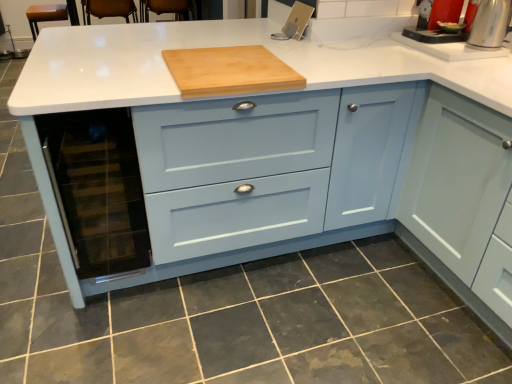
Question: Is the position of natural wood cutting board at center more distant than that of satin silver kettle at upper right?

Choices:
 (A) yes
 (B) no

Answer: (B)

Question: Is natural wood cutting board at center placed right next to satin silver kettle at upper right?

Choices:
 (A) no
 (B) yes

Answer: (A)

Question: From the image's perspective, does natural wood cutting board at center appear higher than satin silver kettle at upper right?

Choices:
 (A) no
 (B) yes

Answer: (A)

Question: Can you confirm if natural wood cutting board at center is positioned to the right of satin silver kettle at upper right?

Choices:
 (A) yes
 (B) no

Answer: (B)

Question: Is natural wood cutting board at center closer to camera compared to satin silver kettle at upper right?

Choices:
 (A) yes
 (B) no

Answer: (A)

Question: Is satin silver kettle at upper right bigger or smaller than white glossy sink at upper right?

Choices:
 (A) big
 (B) small

Answer: (B)

Question: Do you think satin silver kettle at upper right is within white glossy sink at upper right, or outside of it?

Choices:
 (A) inside
 (B) outside

Answer: (B)

Question: From the image's perspective, is satin silver kettle at upper right above or below white glossy sink at upper right?

Choices:
 (A) above
 (B) below

Answer: (B)

Question: Considering the positions of point (497, 18) and point (457, 48), is point (497, 18) closer or farther from the camera than point (457, 48)?

Choices:
 (A) farther
 (B) closer

Answer: (B)

Question: In the image, is dark gray tile at lower center on the left side or the right side of white glossy sink at upper right?

Choices:
 (A) right
 (B) left

Answer: (B)

Question: From a real-world perspective, relative to white glossy sink at upper right, is dark gray tile at lower center vertically above or below?

Choices:
 (A) above
 (B) below

Answer: (B)

Question: Is dark gray tile at lower center inside the boundaries of white glossy sink at upper right, or outside?

Choices:
 (A) outside
 (B) inside

Answer: (A)

Question: Is point (312, 276) closer or farther from the camera than point (452, 36)?

Choices:
 (A) closer
 (B) farther

Answer: (A)

Question: Is satin silver kettle at upper right taller or shorter than natural wood cutting board at center?

Choices:
 (A) short
 (B) tall

Answer: (B)

Question: Considering the positions of point (480, 33) and point (279, 77), is point (480, 33) closer or farther from the camera than point (279, 77)?

Choices:
 (A) closer
 (B) farther

Answer: (B)